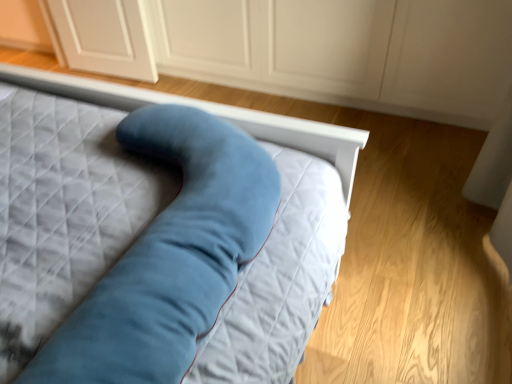
Question: Do you think matte white dresser at center is within velvet blue pillow at center, or outside of it?

Choices:
 (A) inside
 (B) outside

Answer: (B)

Question: Is matte white dresser at center wider or thinner than velvet blue pillow at center?

Choices:
 (A) thin
 (B) wide

Answer: (A)

Question: In terms of size, does matte white dresser at center appear bigger or smaller than velvet blue pillow at center?

Choices:
 (A) big
 (B) small

Answer: (A)

Question: Is velvet blue pillow at center spatially inside matte white dresser at center, or outside of it?

Choices:
 (A) outside
 (B) inside

Answer: (A)

Question: Does point (310, 147) appear closer or farther from the camera than point (202, 36)?

Choices:
 (A) closer
 (B) farther

Answer: (A)

Question: From the image's perspective, is velvet blue pillow at center above or below matte white dresser at center?

Choices:
 (A) above
 (B) below

Answer: (B)

Question: Considering the positions of velvet blue pillow at center and matte white dresser at center in the image, is velvet blue pillow at center wider or thinner than matte white dresser at center?

Choices:
 (A) thin
 (B) wide

Answer: (B)